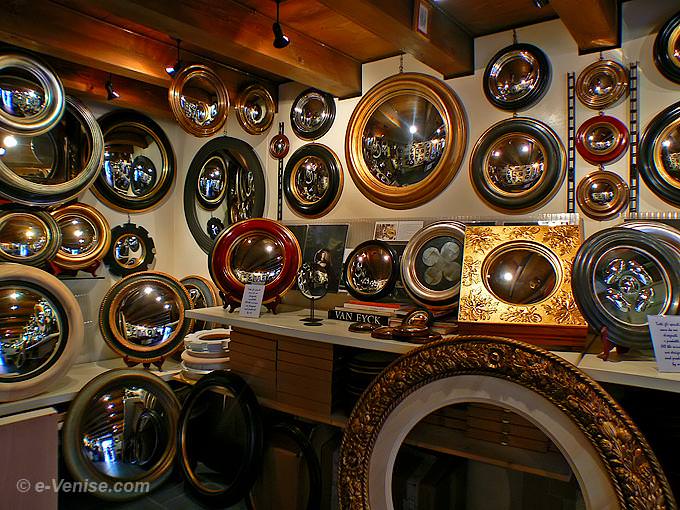
The height and width of the screenshot is (510, 680). I want to click on ceiling beams, so click(x=134, y=88), click(x=134, y=69), click(x=214, y=36), click(x=386, y=21), click(x=578, y=24).